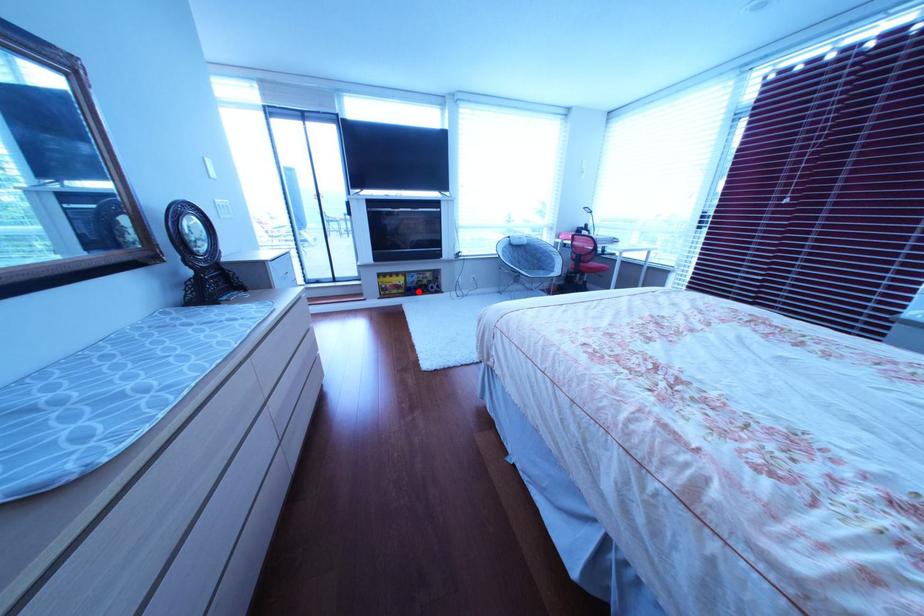
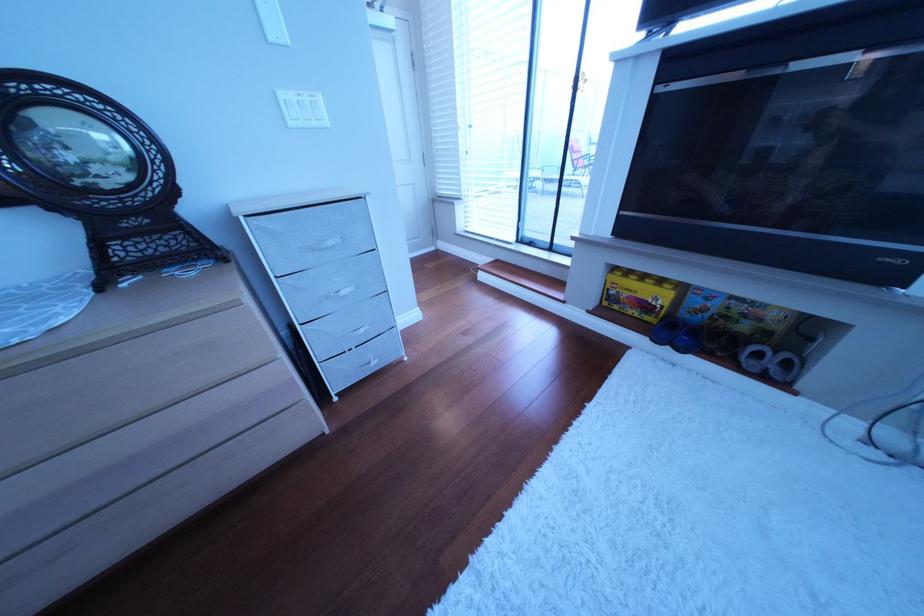
Where in the second image is the point corresponding to the highlighted location from the first image?

(672, 320)